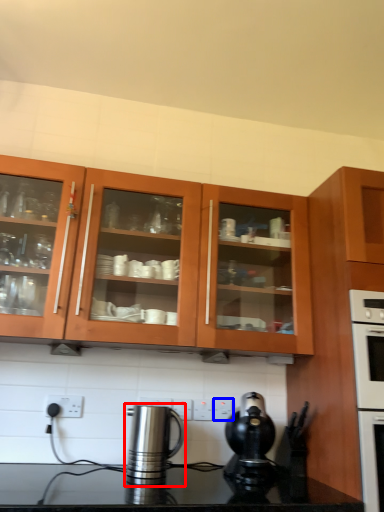
Question: Among these objects, which one is farthest to the camera, kitchen appliance (highlighted by a red box) or electric outlet (highlighted by a blue box)?

Choices:
 (A) kitchen appliance
 (B) electric outlet

Answer: (B)